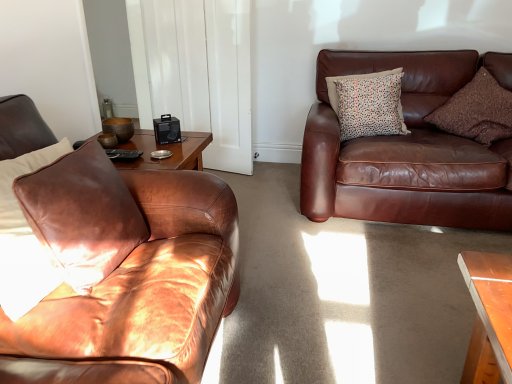
Question: Is brown leather pillow at left, which is the 3th pillow from back to front, next to brown textured pillow at upper right, the first pillow in the right-to-left sequence, and touching it?

Choices:
 (A) yes
 (B) no

Answer: (B)

Question: Is brown leather pillow at left, which is the 3th pillow from back to front, oriented away from brown textured pillow at upper right, the 2th pillow from the front?

Choices:
 (A) yes
 (B) no

Answer: (B)

Question: Is brown leather pillow at left, marked as the first pillow in a left-to-right arrangement, closer to camera compared to brown textured pillow at upper right, the first pillow in the right-to-left sequence?

Choices:
 (A) yes
 (B) no

Answer: (A)

Question: From a real-world perspective, is brown leather pillow at left, marked as the third pillow in a right-to-left arrangement, positioned over brown textured pillow at upper right, the first pillow in the right-to-left sequence, based on gravity?

Choices:
 (A) yes
 (B) no

Answer: (A)

Question: Does brown leather pillow at left, the first pillow from the front, have a greater height compared to brown textured pillow at upper right, the 2th pillow from the front?

Choices:
 (A) no
 (B) yes

Answer: (A)

Question: Is brown leather pillow at left, which is the 3th pillow from back to front, oriented towards brown textured pillow at upper right, which is the 3th pillow in left-to-right order?

Choices:
 (A) no
 (B) yes

Answer: (A)

Question: Is brown leather pillow at left, the first pillow from the front, behind matte brown leather couch at left, marked as the 2th studio couch in a back-to-front arrangement?

Choices:
 (A) yes
 (B) no

Answer: (A)

Question: From a real-world perspective, is brown leather pillow at left, marked as the third pillow in a right-to-left arrangement, positioned over matte brown leather couch at left, the 2th studio couch in the right-to-left sequence, based on gravity?

Choices:
 (A) yes
 (B) no

Answer: (A)

Question: Is brown leather pillow at left, which is the 3th pillow from back to front, shorter than matte brown leather couch at left, positioned as the 1th studio couch in left-to-right order?

Choices:
 (A) yes
 (B) no

Answer: (A)

Question: Can you see brown leather pillow at left, marked as the third pillow in a right-to-left arrangement, touching matte brown leather couch at left, positioned as the 1th studio couch in left-to-right order?

Choices:
 (A) no
 (B) yes

Answer: (B)

Question: Are brown leather pillow at left, the first pillow from the front, and matte brown leather couch at left, positioned as the 1th studio couch in left-to-right order, located far from each other?

Choices:
 (A) no
 (B) yes

Answer: (A)

Question: Can you confirm if brown leather pillow at left, marked as the third pillow in a right-to-left arrangement, is taller than matte brown leather couch at left, positioned as the 1th studio couch in left-to-right order?

Choices:
 (A) yes
 (B) no

Answer: (B)

Question: Is brown leather couch at right, the first studio couch from the right, next to white glossy door at upper center and touching it?

Choices:
 (A) yes
 (B) no

Answer: (B)